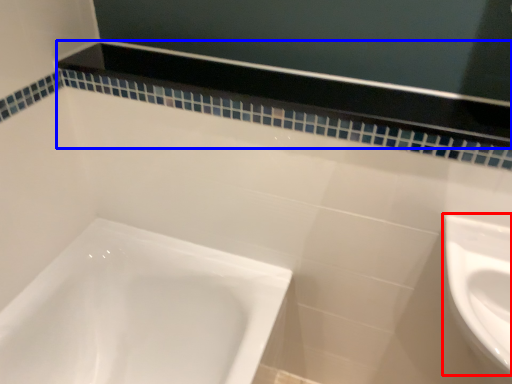
Question: Which object appears closest to the camera in this image, sink (highlighted by a red box) or balustrade (highlighted by a blue box)?

Choices:
 (A) sink
 (B) balustrade

Answer: (A)